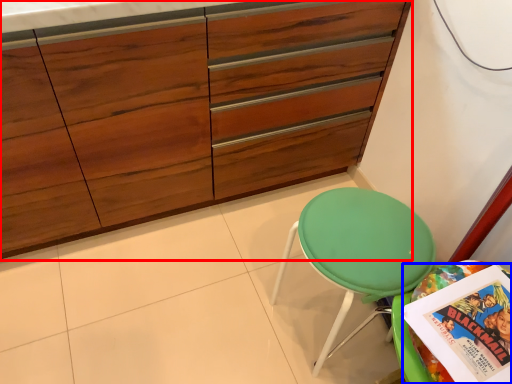
Question: Which object is further to the camera taking this photo, cabinetry (highlighted by a red box) or comic book (highlighted by a blue box)?

Choices:
 (A) cabinetry
 (B) comic book

Answer: (A)